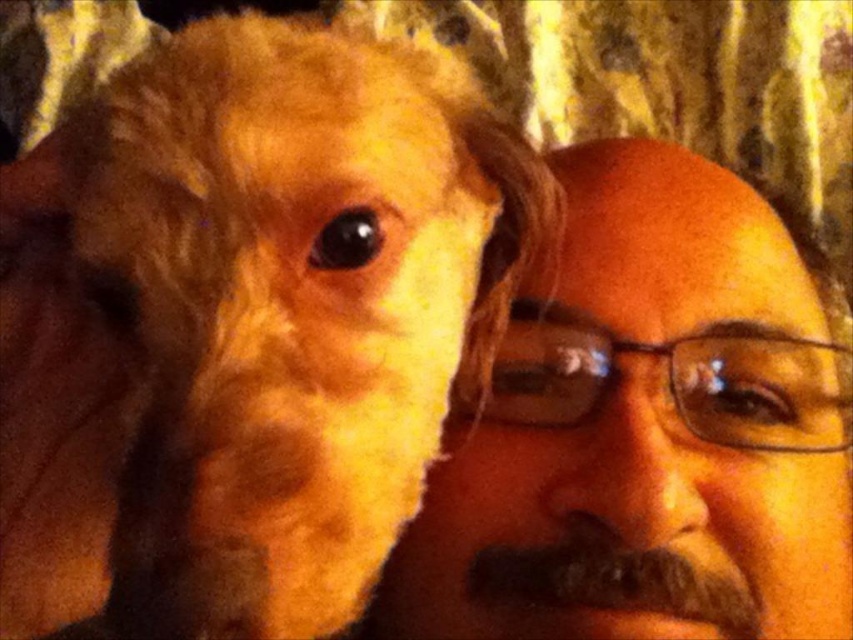
Which is above, smooth skin face at center or brown fuzzy beard at lower center?

smooth skin face at center is higher up.

The width and height of the screenshot is (853, 640). What do you see at coordinates (646, 433) in the screenshot?
I see `smooth skin face at center` at bounding box center [646, 433].

Who is more forward, [782,390] or [735,618]?

Point [735,618] is in front.

Identify the location of smooth skin face at center. (646, 433).

Does fuzzy golden dog at left come behind smooth skin face at center?

No, fuzzy golden dog at left is in front of smooth skin face at center.

Between point (410, 177) and point (560, 422), which one is positioned in front?

Point (410, 177)

Measure the distance between fuzzy golden dog at left and camera.

24.50 centimeters

Locate an element on the screen. fuzzy golden dog at left is located at coordinates (288, 307).

Is point (524, 252) closer to camera compared to point (641, 580)?

No, (524, 252) is behind (641, 580).

Does fuzzy golden dog at left have a greater width compared to brown fuzzy beard at lower center?

Yes, fuzzy golden dog at left is wider than brown fuzzy beard at lower center.

Does point (259, 456) come farther from viewer compared to point (508, 582)?

No.

Where is `fuzzy golden dog at left`? fuzzy golden dog at left is located at coordinates (288, 307).